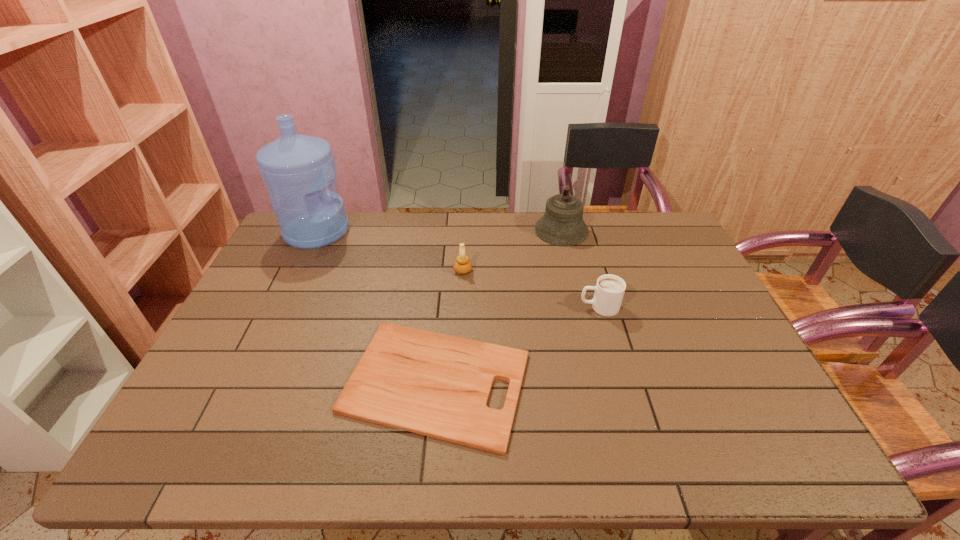
You are a GUI agent. You are given a task and a screenshot of the screen. Output one action in this format:
    pyautogui.click(x=<x>, y=<y>)
    Task: Click on the vacant space located 0.120m on the front of the bell
    
    Given the screenshot: What is the action you would take?
    pyautogui.click(x=570, y=269)

At what (x,y) coordinates should I click in order to perform the action: click on free location located 0.320m on the right of the candle_holder. Please return your answer as a coordinate pair (x, y). The width and height of the screenshot is (960, 540). Looking at the image, I should click on (572, 271).

In order to click on free space located on the side with the handle of the cappuccino in this screenshot , I will do `click(452, 307)`.

Find the location of a particular element. This screenshot has width=960, height=540. free spot located 0.250m on the side with the handle of the cappuccino is located at coordinates (493, 307).

At what (x,y) coordinates should I click in order to perform the action: click on free region located on the side with the handle of the cappuccino. Please return your answer as a coordinate pair (x, y). The width and height of the screenshot is (960, 540). Looking at the image, I should click on (472, 307).

Locate an element on the screen. free location located on the back of the chopping board is located at coordinates (448, 251).

Where is `water jug that is at the far edge`? This screenshot has width=960, height=540. water jug that is at the far edge is located at coordinates (297, 170).

In order to click on bell present at the far edge in this screenshot , I will do 562,224.

The image size is (960, 540). I want to click on object that is positioned at the near edge, so click(437, 385).

The height and width of the screenshot is (540, 960). I want to click on object that is at the left edge, so click(297, 170).